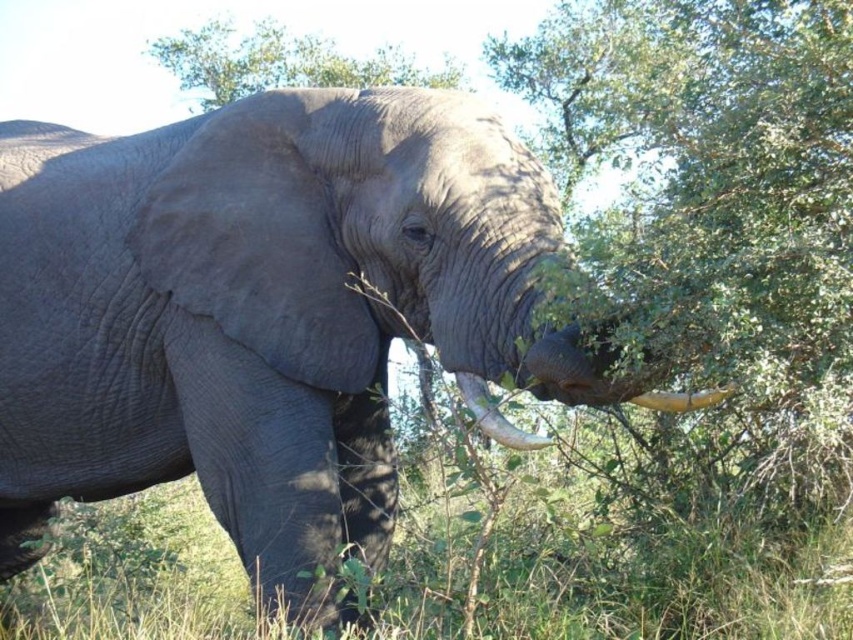
You are a photographer trying to capture the white ivory tusk at lower right and the green grass at lower left in the same frame. Which object will occupy more space in your photo?

The green grass at lower left will occupy more space in the photo because it is bigger than the white ivory tusk at lower right according to the description.

You are a wildlife photographer aiming to capture a close shot of the matte gray tusk at lower left while also including the green leafy tree at upper center in the frame. Given that your camera has a maximum focus range of 6 meters, will you be able to adjust your position to include both objects in the photo?

The green leafy tree at upper center is 6.24 meters away from the matte gray tusk at lower left. Since your camera can only focus up to 6 meters, you won

You are standing at the center of the image and want to step onto the green grass at lower left. In which direction should you move relative to your current position?

To reach the green grass at lower left, you should move towards the lower left direction from your current position at the center of the image.